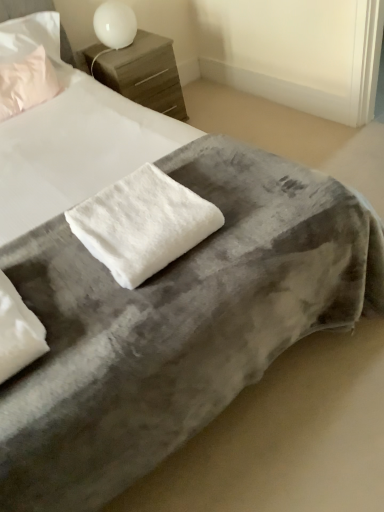
Question: Would you say matte pink pillow at upper left, the first pillow positioned from the left, is inside or outside wooden nightstand at upper center?

Choices:
 (A) outside
 (B) inside

Answer: (A)

Question: From the image's perspective, is matte pink pillow at upper left, the 2th pillow from the front, above or below wooden nightstand at upper center?

Choices:
 (A) below
 (B) above

Answer: (A)

Question: Which is nearer to the matte pink pillow at upper left, the 2th pillow from the front?

Choices:
 (A) white fluffy pillow at lower left, which is counted as the 1th pillow, starting from the bottom
 (B) wooden nightstand at upper center
 (C) white fluffy towel at center
 (D) white glossy table lamp at upper center

Answer: (B)

Question: Considering the real-world distances, which object is farthest from the white fluffy pillow at lower left, the first pillow in the right-to-left sequence?

Choices:
 (A) wooden nightstand at upper center
 (B) matte pink pillow at upper left, the first pillow positioned from the left
 (C) white fluffy towel at center
 (D) white glossy table lamp at upper center

Answer: (D)